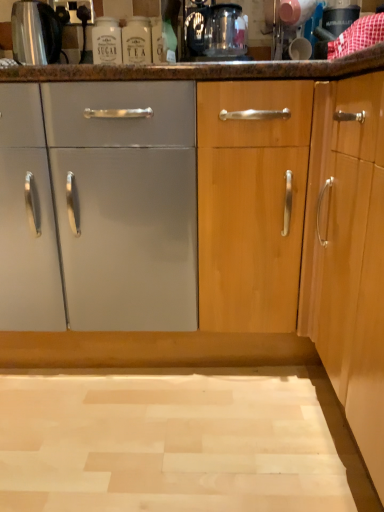
Question: Considering the positions of transparent glass coffee machine at upper center and white glass bottle at upper center in the image, is transparent glass coffee machine at upper center taller or shorter than white glass bottle at upper center?

Choices:
 (A) short
 (B) tall

Answer: (A)

Question: From a real-world perspective, is transparent glass coffee machine at upper center above or below white glass bottle at upper center?

Choices:
 (A) below
 (B) above

Answer: (B)

Question: Which is nearer to the white glass bottle at upper center?

Choices:
 (A) transparent glass coffee machine at upper center
 (B) brushed metal kettle at upper left

Answer: (A)

Question: Which is farther from the white glass bottle at upper center?

Choices:
 (A) brushed metal kettle at upper left
 (B) transparent glass coffee machine at upper center

Answer: (A)